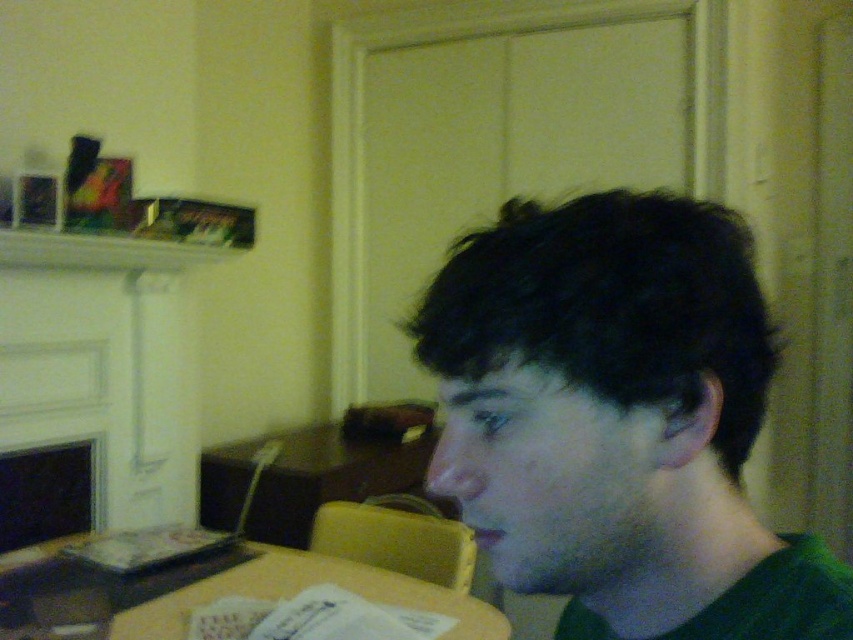
You are standing in the living room and want to place a small decoration at the point marked as point (650, 397). If your hand is 12 inches away from that point, will you be able to reach it without moving closer?

The distance of point (650, 397) from the viewer is 16.54 inches. Since your hand is only 12 inches away from the point, you are still 4.54 inches too far to reach it without moving closer.

You are designing a room layout and need to ensure that the dark green hair at center and the matte black fireplace at lower left are visible from the entrance. Given their sizes, which object might require more space to be properly accommodated?

The dark green hair at center has a larger width than the matte black fireplace at lower left, so it might require more space to be properly accommodated.

You are a photographer taking a picture of the dark green hair at center and the wooden table at lower center. Which object is positioned higher in the frame?

The dark green hair at center is above the wooden table at lower center, so it is positioned higher in the frame.